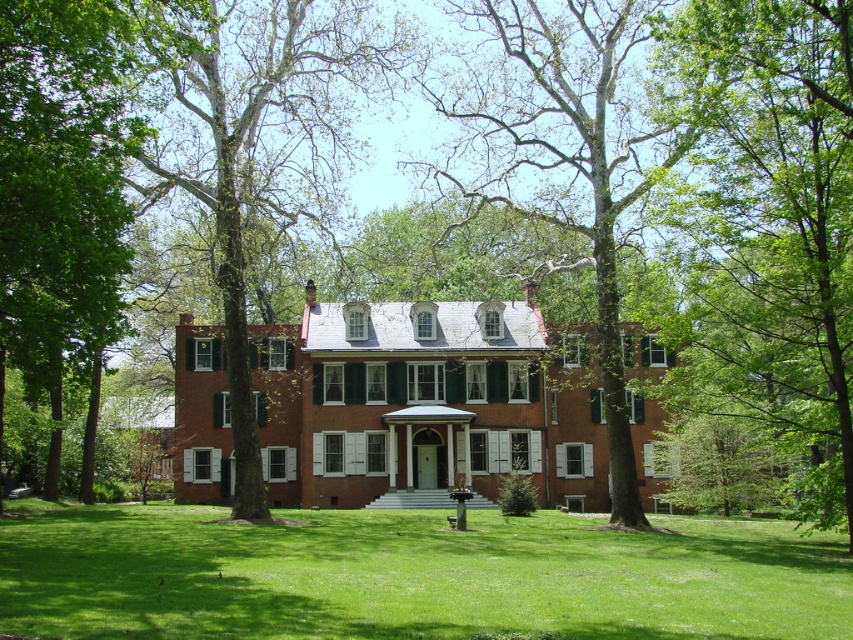
Question: Which is nearer to the green leafy tree at center?

Choices:
 (A) green grass at center
 (B) green leafy tree at upper right

Answer: (B)

Question: From the image, what is the correct spatial relationship of green leafy tree at upper right in relation to smooth bark tree at center?

Choices:
 (A) above
 (B) below

Answer: (B)

Question: Which object is positioned farthest from the green grass at center?

Choices:
 (A) green leafy tree at left
 (B) green leafy tree at upper right

Answer: (A)

Question: Observing the image, what is the correct spatial positioning of green grass at center in reference to green leafy tree at center?

Choices:
 (A) right
 (B) left

Answer: (A)

Question: Does smooth bark tree at center appear on the left side of green leafy tree at left?

Choices:
 (A) no
 (B) yes

Answer: (A)

Question: Which object is closer to the camera taking this photo?

Choices:
 (A) smooth bark tree at center
 (B) green leafy tree at center

Answer: (B)